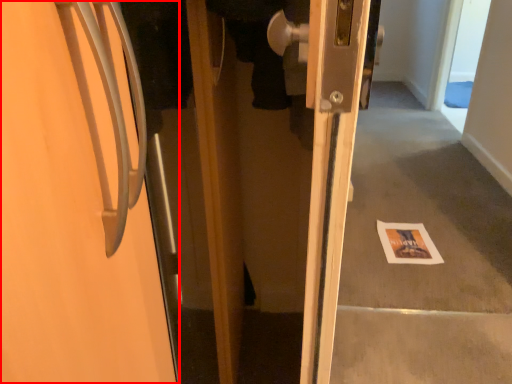
Question: From the image's perspective, what is the correct spatial relationship of door (annotated by the red box) in relation to postcard?

Choices:
 (A) below
 (B) above

Answer: (B)